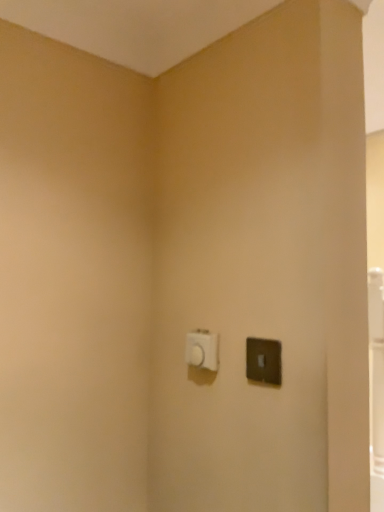
Question: Is white plastic light switch at center, marked as the second light switch in a right-to-left arrangement, in front of or behind satin black light switch at right, which is the second light switch from back to front, in the image?

Choices:
 (A) behind
 (B) front

Answer: (A)

Question: Choose the correct answer: Is white plastic light switch at center, placed as the 1th light switch when sorted from left to right, inside satin black light switch at right, which is counted as the 2th light switch, starting from the left, or outside it?

Choices:
 (A) outside
 (B) inside

Answer: (A)

Question: In terms of height, does white plastic light switch at center, the 1th light switch viewed from the back, look taller or shorter compared to satin black light switch at right, which is the second light switch from back to front?

Choices:
 (A) tall
 (B) short

Answer: (B)

Question: Based on their sizes in the image, would you say satin black light switch at right, which is the second light switch from back to front, is bigger or smaller than white plastic light switch at center, placed as the 1th light switch when sorted from left to right?

Choices:
 (A) big
 (B) small

Answer: (B)

Question: From a real-world perspective, is satin black light switch at right, which is counted as the 2th light switch, starting from the left, positioned above or below white plastic light switch at center, the 1th light switch viewed from the back?

Choices:
 (A) below
 (B) above

Answer: (A)

Question: In the image, is satin black light switch at right, positioned as the 1th light switch in right-to-left order, positioned in front of or behind white plastic light switch at center, placed as the second light switch when sorted from front to back?

Choices:
 (A) behind
 (B) front

Answer: (B)

Question: Is point (258, 343) positioned closer to the camera than point (196, 355)?

Choices:
 (A) farther
 (B) closer

Answer: (B)